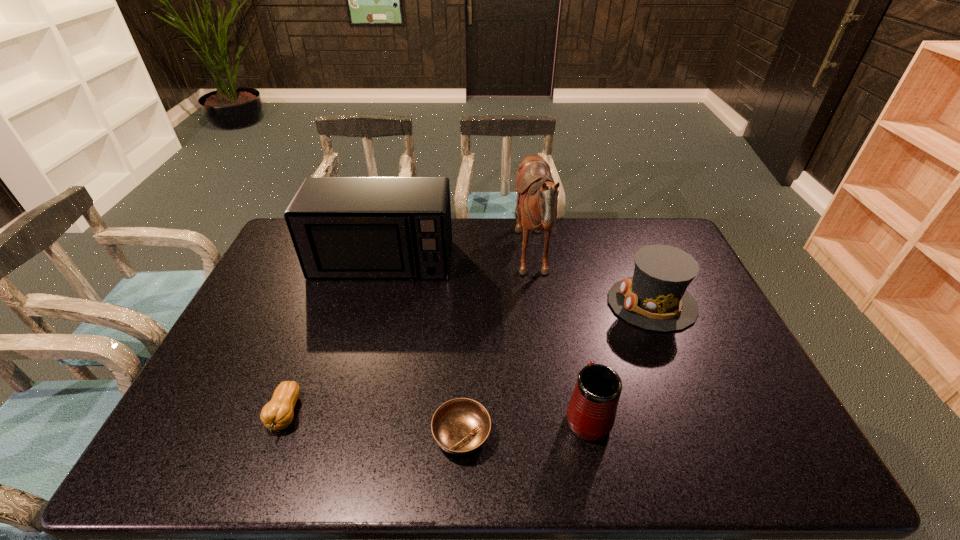
The height and width of the screenshot is (540, 960). Find the location of `gourd that is positioned at the near edge`. gourd that is positioned at the near edge is located at coordinates (277, 414).

At what (x,y) coordinates should I click in order to perform the action: click on soup bowl that is positioned at the near edge. Please return your answer as a coordinate pair (x, y). This screenshot has width=960, height=540. Looking at the image, I should click on (460, 426).

Image resolution: width=960 pixels, height=540 pixels. I want to click on object situated at the left edge, so click(x=341, y=227).

What are the coordinates of `object that is at the right edge` in the screenshot? It's located at (655, 298).

The image size is (960, 540). I want to click on object located in the far left corner section of the desktop, so click(341, 227).

Where is `free region at the far edge`? The height and width of the screenshot is (540, 960). free region at the far edge is located at coordinates (492, 226).

You are a GUI agent. You are given a task and a screenshot of the screen. Output one action in this format:
    pyautogui.click(x=<x>, y=<y>)
    Task: Click on the vacant position at the near edge of the desktop
    
    Given the screenshot: What is the action you would take?
    pyautogui.click(x=324, y=471)

Find the location of a particular element. vacant space at the left edge of the desktop is located at coordinates (291, 264).

What are the coordinates of `vacant space at the right edge of the desktop` in the screenshot? It's located at (701, 387).

Locate an element on the screen. vacant region at the near left corner of the desktop is located at coordinates (174, 474).